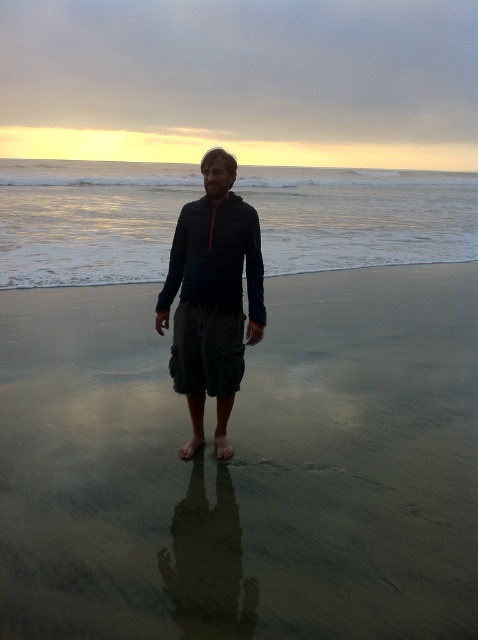
Question: Does sandy at center appear on the left side of matte black hoodie at center?

Choices:
 (A) yes
 (B) no

Answer: (A)

Question: Among these points, which one is farthest from the camera?

Choices:
 (A) (204, 340)
 (B) (273, 515)
 (C) (305, 221)

Answer: (C)

Question: Is sandy at center above matte black hoodie at center?

Choices:
 (A) no
 (B) yes

Answer: (A)

Question: Is sandy at center further to the viewer compared to matte black hoodie at center?

Choices:
 (A) yes
 (B) no

Answer: (A)

Question: Which object is positioned closest to the matte black hoodie at center?

Choices:
 (A) clear water at center
 (B) sandy at center

Answer: (B)

Question: Among these points, which one is nearest to the camera?

Choices:
 (A) (224, 314)
 (B) (166, 205)
 (C) (172, 412)

Answer: (A)